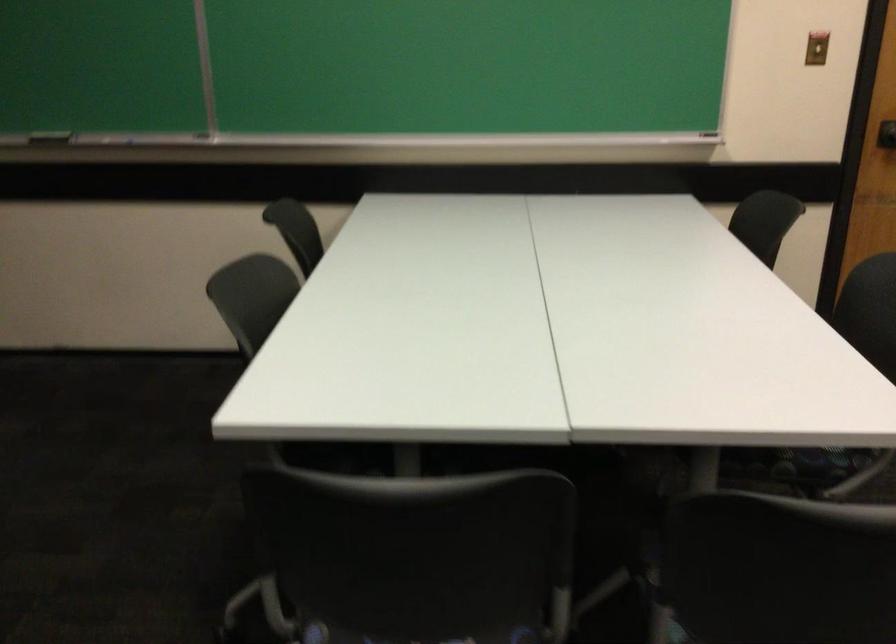
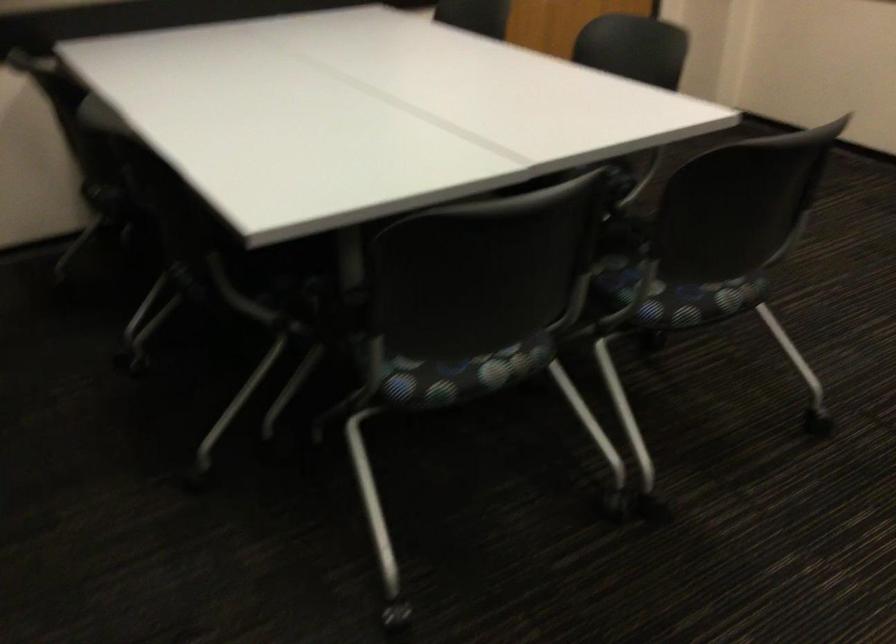
Question: The first image is from the beginning of the video and the second image is from the end. How did the camera likely rotate when shooting the video?

Choices:
 (A) Left
 (B) Right
 (C) Up
 (D) Down

Answer: (B)